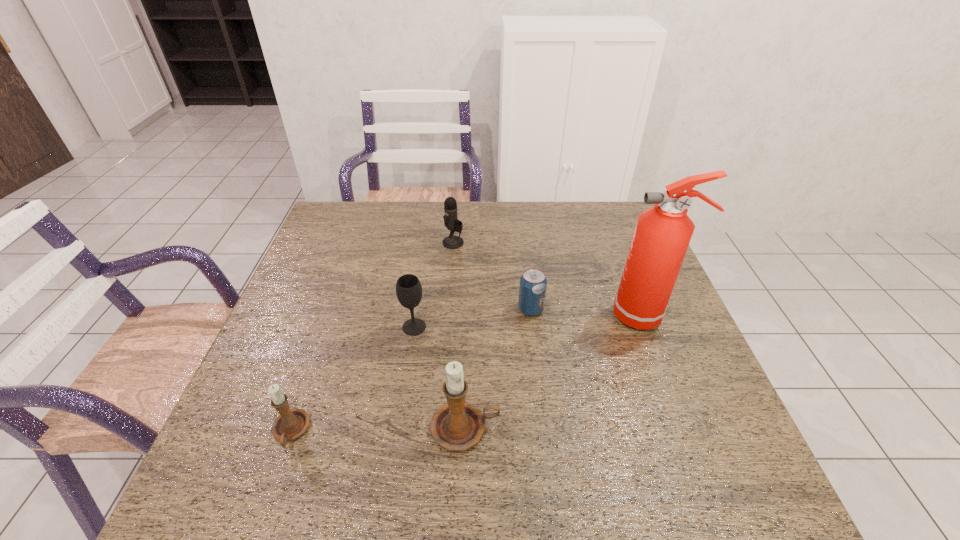
You are a GUI agent. You are given a task and a screenshot of the screen. Output one action in this format:
    pyautogui.click(x=<x>, y=<y>)
    Task: Click on the vacant region located 0.310m on the side of the taller candle holder with the handle
    The width and height of the screenshot is (960, 540).
    Given the screenshot: What is the action you would take?
    pyautogui.click(x=651, y=429)

Where is `free space located on the back of the farthest object`? free space located on the back of the farthest object is located at coordinates (454, 227).

In order to click on free space located 0.230m on the right of the wineglass in this screenshot , I will do `click(517, 327)`.

Locate an element on the screen. free space located on the left of the shortest object is located at coordinates tap(465, 309).

Identify the location of free spot located 0.060m at the nozzle of the tallest object. The height and width of the screenshot is (540, 960). (589, 315).

Identify the location of vacant region located 0.240m at the nozzle of the tallest object. This screenshot has height=540, width=960. (519, 315).

At what (x,y) coordinates should I click in order to perform the action: click on free space located at the nozzle of the tallest object. Please return your answer as a coordinate pair (x, y). The width and height of the screenshot is (960, 540). Looking at the image, I should click on (574, 315).

Locate an element on the screen. The image size is (960, 540). object present at the far edge is located at coordinates (451, 222).

At what (x,y) coordinates should I click in order to perform the action: click on object located at the left edge. Please return your answer as a coordinate pair (x, y). This screenshot has height=540, width=960. Looking at the image, I should click on (291, 423).

The height and width of the screenshot is (540, 960). What are the coordinates of `object that is at the right edge` in the screenshot? It's located at (662, 235).